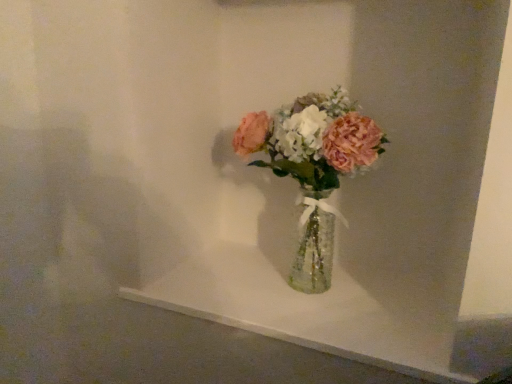
Question: Should I look upward or downward to see translucent glass vase at center?

Choices:
 (A) down
 (B) up

Answer: (B)